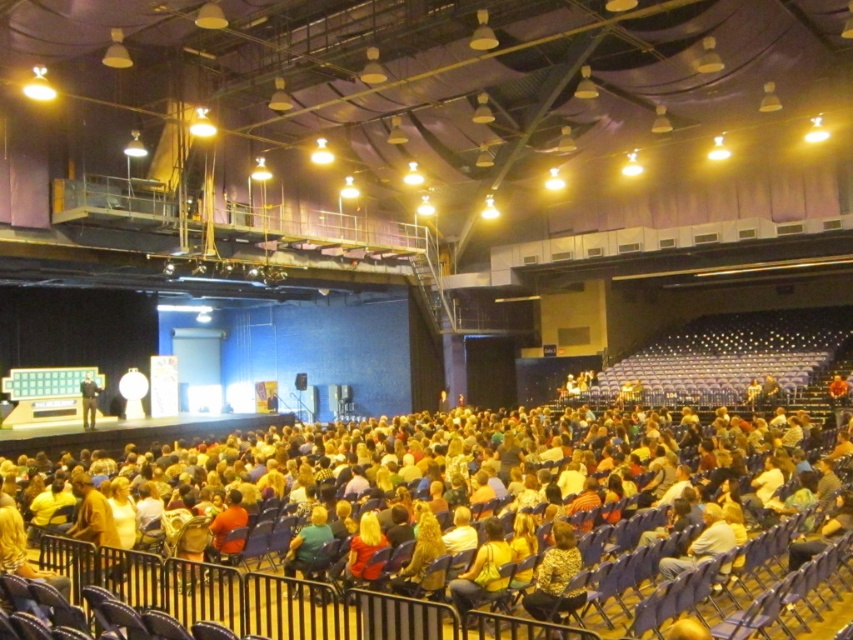
Question: Which point is closer to the camera?

Choices:
 (A) yellow shirt at center
 (B) floral-patterned shirt at center
 (C) multicolored fabric crowd at center

Answer: (C)

Question: Which point appears farthest from the camera in this image?

Choices:
 (A) (126, 584)
 (B) (560, 593)
 (C) (486, 595)
 (D) (88, 404)

Answer: (D)

Question: Is multicolored fabric crowd at center thinner than floral-patterned shirt at center?

Choices:
 (A) yes
 (B) no

Answer: (B)

Question: Is the position of multicolored fabric crowd at center more distant than that of light brown leather jacket at center?

Choices:
 (A) yes
 (B) no

Answer: (B)

Question: Which of the following is the closest to the observer?

Choices:
 (A) (567, 598)
 (B) (131, 604)
 (C) (712, 556)

Answer: (A)

Question: Is multicolored fabric crowd at center positioned before yellow shirt at center?

Choices:
 (A) yes
 (B) no

Answer: (A)